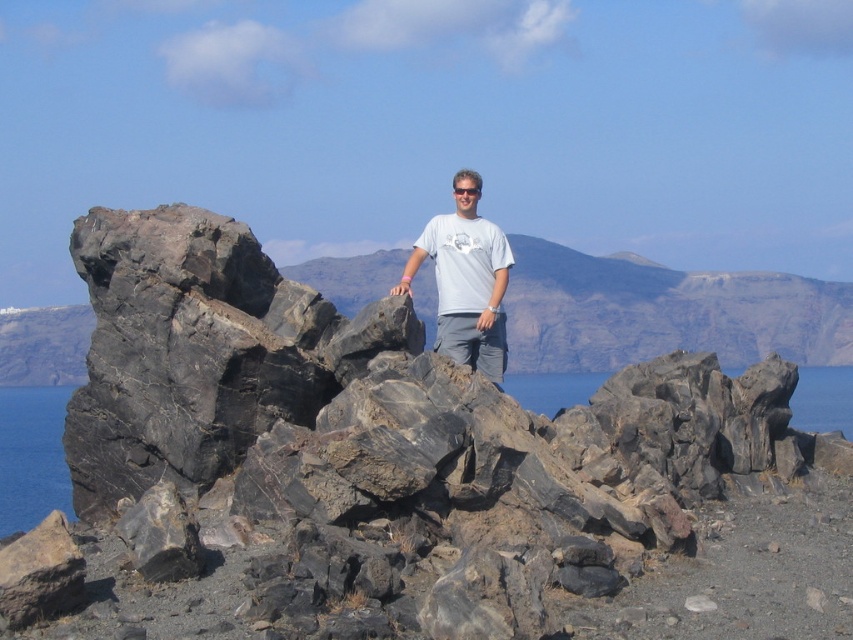
Is black volcanic rock at center positioned behind black rock at center?

No, black volcanic rock at center is closer to the viewer.

From the picture: Which is below, black volcanic rock at center or black rock at center?

Positioned lower is black rock at center.

Between point (126, 390) and point (6, 401), which one is positioned behind?

The point (6, 401) is behind.

Identify the location of black volcanic rock at center. The width and height of the screenshot is (853, 640). (402, 476).

Is black rock at center to the right of white matte t-shirt at center from the viewer's perspective?

Indeed, black rock at center is positioned on the right side of white matte t-shirt at center.

Does point (61, 424) come in front of point (486, 282)?

No, (61, 424) is further to viewer.

I want to click on black rock at center, so click(32, 456).

Does black volcanic rock at center have a lesser width compared to transparent water at rock right?

Indeed, black volcanic rock at center has a lesser width compared to transparent water at rock right.

Can you confirm if black volcanic rock at center is positioned to the left of transparent water at rock right?

Indeed, black volcanic rock at center is positioned on the left side of transparent water at rock right.

Describe the element at coordinates (402, 476) in the screenshot. I see `black volcanic rock at center` at that location.

Find the location of a particular element. The height and width of the screenshot is (640, 853). black volcanic rock at center is located at coordinates (402, 476).